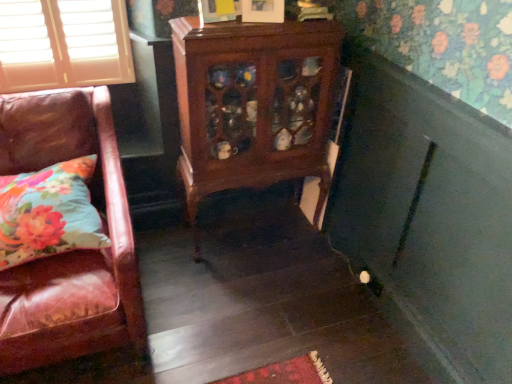
Find the location of a particular element. The width and height of the screenshot is (512, 384). vacant area that is in front of mahogany cabinet at center is located at coordinates (251, 297).